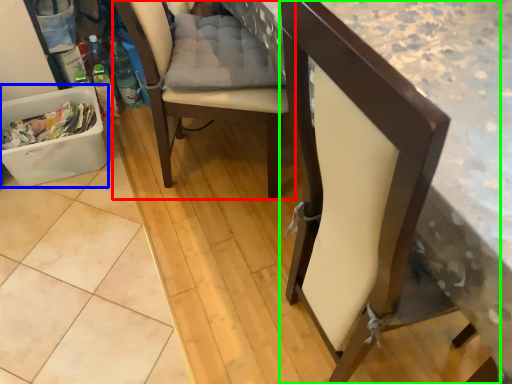
Question: Which object is the closest to the chair (highlighted by a red box)? Choose among these: laundry basket (highlighted by a blue box) or chair (highlighted by a green box).

Choices:
 (A) laundry basket
 (B) chair

Answer: (A)